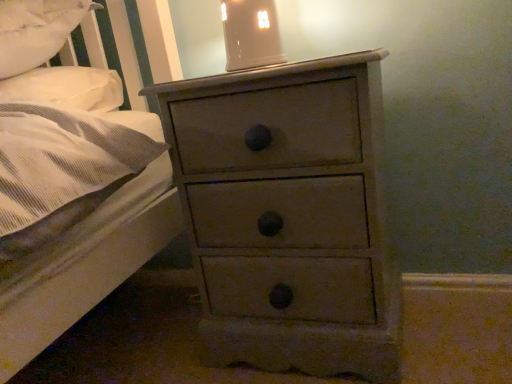
In the scene shown: What is the approximate height of white soft pillow at upper left?

white soft pillow at upper left is 8.64 inches tall.

Where is `white soft pillow at upper left`? white soft pillow at upper left is located at coordinates (36, 31).

Where is `matte ceramic lampshade at upper center`? This screenshot has height=384, width=512. matte ceramic lampshade at upper center is located at coordinates (251, 34).

Locate an element on the screen. The width and height of the screenshot is (512, 384). white soft pillow at upper left is located at coordinates (36, 31).

Considering the relative positions of distressed gray chest of drawers at center and white soft pillow at upper left in the image provided, is distressed gray chest of drawers at center to the left or to the right of white soft pillow at upper left?

From the image, it's evident that distressed gray chest of drawers at center is to the right of white soft pillow at upper left.

Could white soft pillow at upper left be considered to be inside distressed gray chest of drawers at center?

No, distressed gray chest of drawers at center does not contain white soft pillow at upper left.

Considering the points (332, 67) and (29, 56), which point is behind, point (332, 67) or point (29, 56)?

Positioned behind is point (29, 56).

From the image's perspective, is white soft pillow at upper left over matte ceramic lampshade at upper center?

No, from the image's perspective, white soft pillow at upper left is not above matte ceramic lampshade at upper center.

What's the angular difference between white soft pillow at upper left and matte ceramic lampshade at upper center's facing directions?

The facing directions of white soft pillow at upper left and matte ceramic lampshade at upper center are 96.6 degrees apart.

Between point (37, 61) and point (272, 63), which one is positioned in front?

Positioned in front is point (272, 63).

Considering the sizes of objects white soft pillow at upper left and matte ceramic lampshade at upper center in the image provided, who is thinner, white soft pillow at upper left or matte ceramic lampshade at upper center?

matte ceramic lampshade at upper center.

Does point (353, 55) appear closer or farther from the camera than point (258, 49)?

Clearly, point (353, 55) is closer to the camera than point (258, 49).

Does distressed gray chest of drawers at center have a smaller size compared to matte ceramic lampshade at upper center?

No, distressed gray chest of drawers at center is not smaller than matte ceramic lampshade at upper center.

From the image's perspective, which one is positioned lower, white soft pillow at upper left or distressed gray chest of drawers at center?

distressed gray chest of drawers at center appears lower in the image.

From the picture: Is white soft pillow at upper left spatially inside distressed gray chest of drawers at center, or outside of it?

white soft pillow at upper left lies outside distressed gray chest of drawers at center.

Is white soft pillow at upper left facing away from distressed gray chest of drawers at center?

No, white soft pillow at upper left is not facing away from distressed gray chest of drawers at center.

Is white soft pillow at upper left positioned far away from distressed gray chest of drawers at center?

white soft pillow at upper left is near distressed gray chest of drawers at center, not far away.

From a real-world perspective, which object rests below the other?

white soft pillow at upper left.

What's the angular difference between matte ceramic lampshade at upper center and white soft pillow at upper left's facing directions?

96.6 degrees separate the facing orientations of matte ceramic lampshade at upper center and white soft pillow at upper left.

Measure the distance from matte ceramic lampshade at upper center to white soft pillow at upper left.

A distance of 17.92 inches exists between matte ceramic lampshade at upper center and white soft pillow at upper left.

From the picture: Is the depth of matte ceramic lampshade at upper center greater than that of white soft pillow at upper left?

Yes.

Based on their sizes in the image, would you say matte ceramic lampshade at upper center is bigger or smaller than distressed gray chest of drawers at center?

Clearly, matte ceramic lampshade at upper center is smaller in size than distressed gray chest of drawers at center.

Which is more to the left, matte ceramic lampshade at upper center or distressed gray chest of drawers at center?

Positioned to the left is matte ceramic lampshade at upper center.

Based on the photo, are matte ceramic lampshade at upper center and distressed gray chest of drawers at center making contact?

No, matte ceramic lampshade at upper center is not in contact with distressed gray chest of drawers at center.

Which point is more forward, [240,12] or [220,346]?

Positioned in front is point [240,12].

The height and width of the screenshot is (384, 512). I want to click on pillow lying behind the distressed gray chest of drawers at center, so click(36, 31).

Locate an element on the screen. The height and width of the screenshot is (384, 512). pillow that appears below the matte ceramic lampshade at upper center (from a real-world perspective) is located at coordinates (36, 31).

Which object lies nearer to the anchor point white soft pillow at upper left, distressed gray chest of drawers at center or matte ceramic lampshade at upper center?

matte ceramic lampshade at upper center is closer to white soft pillow at upper left.

Considering their positions, is distressed gray chest of drawers at center positioned closer to matte ceramic lampshade at upper center than white soft pillow at upper left?

Among the two, distressed gray chest of drawers at center is located nearer to matte ceramic lampshade at upper center.

Which object lies nearer to the anchor point white soft pillow at upper left, matte ceramic lampshade at upper center or distressed gray chest of drawers at center?

The object closer to white soft pillow at upper left is matte ceramic lampshade at upper center.

When comparing their distances from distressed gray chest of drawers at center, does white soft pillow at upper left or matte ceramic lampshade at upper center seem closer?

matte ceramic lampshade at upper center is positioned closer to the anchor distressed gray chest of drawers at center.

Estimate the real-world distances between objects in this image. Which object is closer to matte ceramic lampshade at upper center, white soft pillow at upper left or distressed gray chest of drawers at center?

Among the two, distressed gray chest of drawers at center is located nearer to matte ceramic lampshade at upper center.

Estimate the real-world distances between objects in this image. Which object is further from distressed gray chest of drawers at center, matte ceramic lampshade at upper center or white soft pillow at upper left?

The object further to distressed gray chest of drawers at center is white soft pillow at upper left.

The width and height of the screenshot is (512, 384). What are the coordinates of `bedside lamp between white soft pillow at upper left and distressed gray chest of drawers at center from left to right` in the screenshot? It's located at (251, 34).